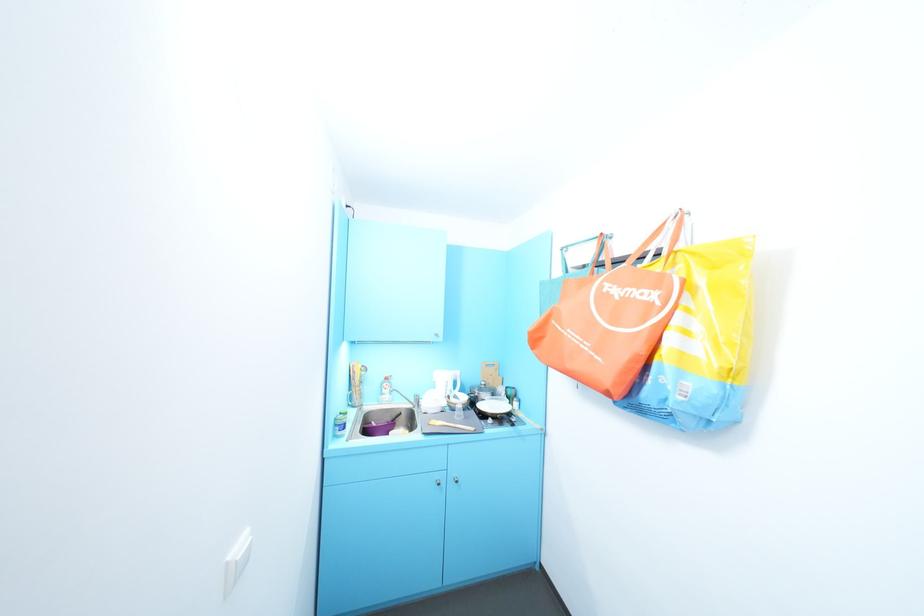
Describe the element at coordinates (407, 397) in the screenshot. I see `the faucet handle` at that location.